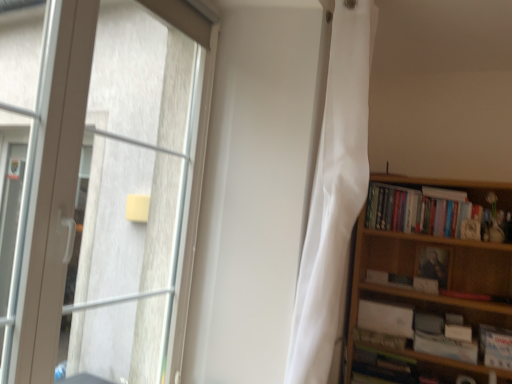
Question: Considering the relative positions of matte black portrait at upper right, which is the 1th paperback book from top to bottom, and white matte book at right, which appears as the fourth book when ordered from the bottom, in the image provided, is matte black portrait at upper right, which is the 1th paperback book from top to bottom, to the left or to the right of white matte book at right, which appears as the fourth book when ordered from the bottom,?

Choices:
 (A) right
 (B) left

Answer: (A)

Question: Does point (420, 268) appear closer or farther from the camera than point (412, 281)?

Choices:
 (A) closer
 (B) farther

Answer: (A)

Question: Which is farther from the white matte book at right, which appears as the fourth book when ordered from the bottom?

Choices:
 (A) wooden bookcase at right
 (B) hardcover books at right, positioned as the fifth book in bottom-to-top order
 (C) matte black portrait at upper right, which is the 1th paperback book from top to bottom
 (D) white paper book at right, marked as the second book in a bottom-to-top arrangement
 (E) white silky curtain at center

Answer: (E)

Question: Which object is the farthest from the white matte paperback book at lower right, placed as the 2th paperback book when sorted from top to bottom?

Choices:
 (A) wooden bookcase at right
 (B) white matte book at lower right, which ranks as the third book in bottom-to-top order
 (C) hardcover books at right, the first book when ordered from top to bottom
 (D) white matte book at right, acting as the 2th book starting from the top
 (E) white silky curtain at center

Answer: (E)